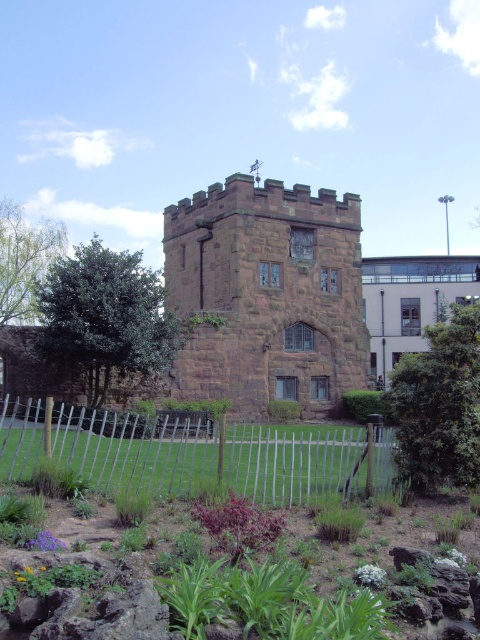
Question: Which of these objects is positioned closest to the brown stone tower at center?

Choices:
 (A) green leafy plants at lower center
 (B) white wooden fence at lower center

Answer: (B)

Question: Can you confirm if brown stone tower at center is positioned above green leafy plants at lower center?

Choices:
 (A) no
 (B) yes

Answer: (B)

Question: Does white wooden fence at lower center have a lesser width compared to green leafy plants at lower center?

Choices:
 (A) yes
 (B) no

Answer: (A)

Question: Which is nearer to the brown stone tower at center?

Choices:
 (A) green leafy plants at lower center
 (B) white wooden fence at lower center

Answer: (B)

Question: Which is farther from the white wooden fence at lower center?

Choices:
 (A) green leafy plants at lower center
 (B) brown stone tower at center

Answer: (B)

Question: Does white wooden fence at lower center appear on the left side of green leafy plants at lower center?

Choices:
 (A) yes
 (B) no

Answer: (B)